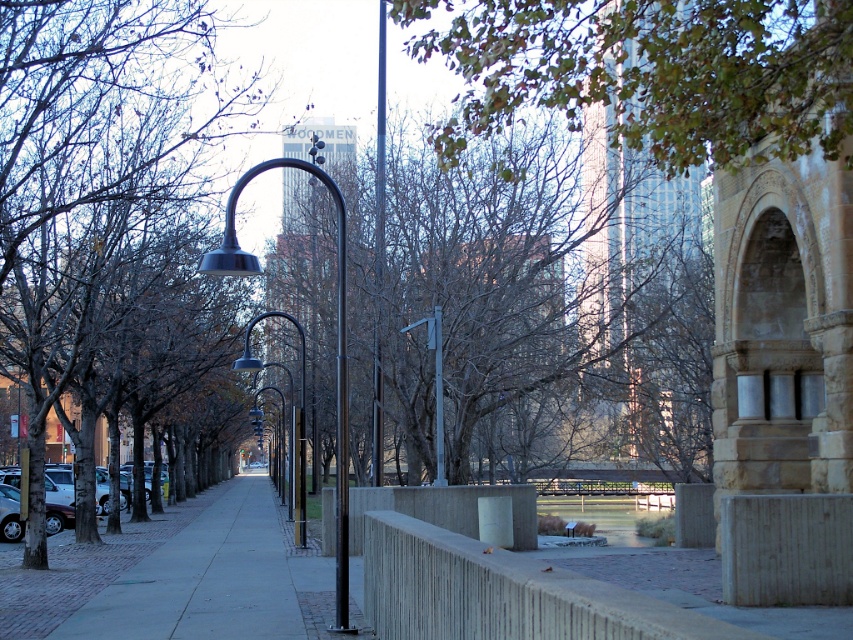
Question: Which object is closer to the camera taking this photo?

Choices:
 (A) silver metallic car at lower left
 (B) silver metallic street light at center
 (C) smooth metal pole at center

Answer: (A)

Question: Among these points, which one is farthest from the camera?

Choices:
 (A) (576, 163)
 (B) (194, 173)
 (C) (247, 349)

Answer: (B)

Question: Does silver metallic street light at center appear under metallic pole at center?

Choices:
 (A) yes
 (B) no

Answer: (B)

Question: Where is green leafy tree at upper center located in relation to silver metallic street light at center in the image?

Choices:
 (A) left
 (B) right

Answer: (B)

Question: Among these objects, which one is nearest to the camera?

Choices:
 (A) smooth metal pole at center
 (B) brown leafless tree at left
 (C) gray concrete sidewalk at center

Answer: (C)

Question: Is brown leafy tree at center smaller than brown leafless tree at left?

Choices:
 (A) yes
 (B) no

Answer: (A)